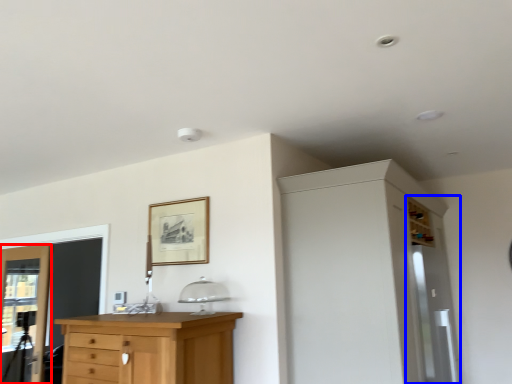
Question: Which point is closer to the camera, door (highlighted by a red box) or screen door (highlighted by a blue box)?

Choices:
 (A) door
 (B) screen door

Answer: (B)